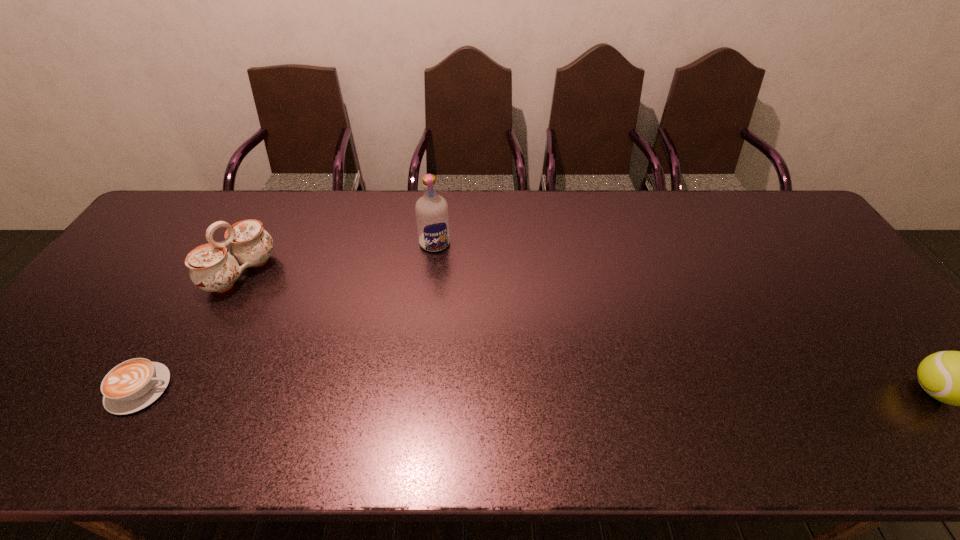
Image resolution: width=960 pixels, height=540 pixels. What are the coordinates of `free point between the shortest object and the third shortest object` in the screenshot? It's located at (191, 330).

Where is `vacant space that's between the chinaware and the cappuccino`? The height and width of the screenshot is (540, 960). vacant space that's between the chinaware and the cappuccino is located at coordinates (191, 330).

Identify the location of free space between the cappuccino and the vodka. (287, 316).

You are a GUI agent. You are given a task and a screenshot of the screen. Output one action in this format:
    pyautogui.click(x=<x>, y=<y>)
    Task: Click on the free spot between the second tallest object and the shortest object
    Image resolution: width=960 pixels, height=540 pixels.
    Given the screenshot: What is the action you would take?
    pyautogui.click(x=191, y=330)

Find the location of a particular element. vacant region between the chinaware and the vodka is located at coordinates (338, 258).

Where is `empty space between the second object from right to left and the shortest object`? empty space between the second object from right to left and the shortest object is located at coordinates (287, 316).

Locate an element on the screen. This screenshot has width=960, height=540. vacant area that lies between the shortest object and the tallest object is located at coordinates (287, 316).

The image size is (960, 540). What are the coordinates of `the third closest object to the chinaware` in the screenshot? It's located at (959, 378).

Identify which object is the second nearest to the third object from left to right. Please provide its 2D coordinates. Your answer should be formatted as a tuple, i.e. [(x, y)], where the tuple contains the x and y coordinates of a point satisfying the conditions above.

[(134, 384)]